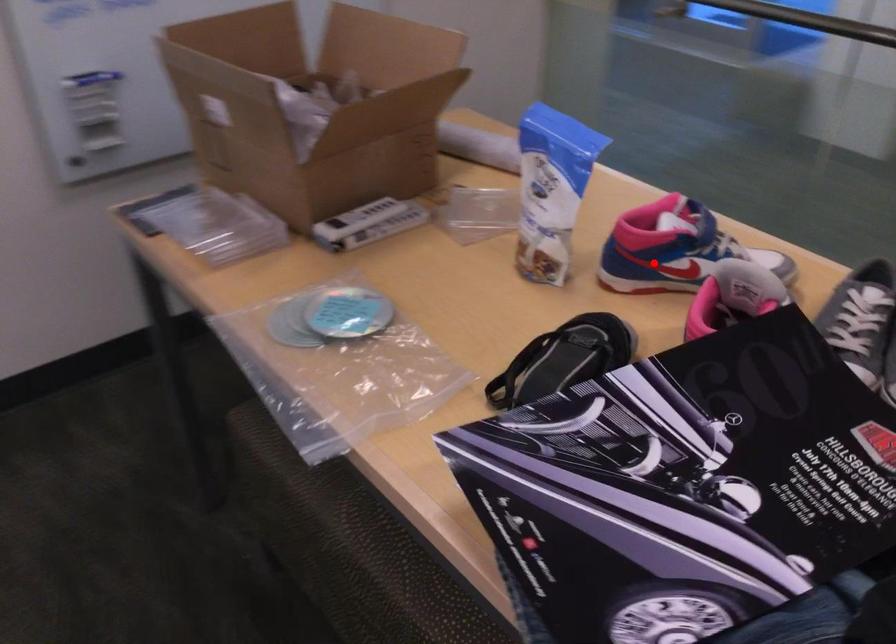
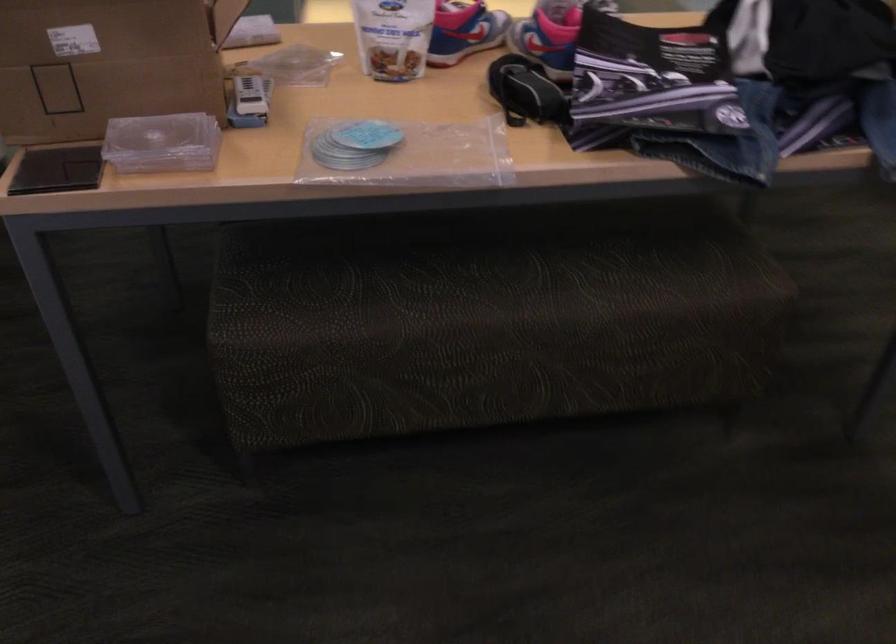
In the second image, find the point that corresponds to the highlighted location in the first image.

(463, 31)